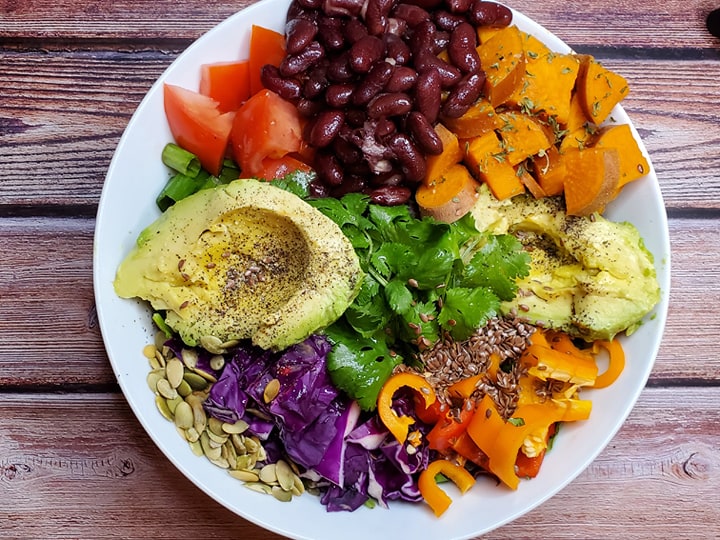
You are a GUI agent. You are given a task and a screenshot of the screen. Output one action in this format:
    pyautogui.click(x=<x>, y=<y>)
    Task: Click on the spaces between boards on table
    This screenshot has height=540, width=720.
    Given the screenshot: What is the action you would take?
    pyautogui.click(x=675, y=384), pyautogui.click(x=687, y=212), pyautogui.click(x=662, y=52)